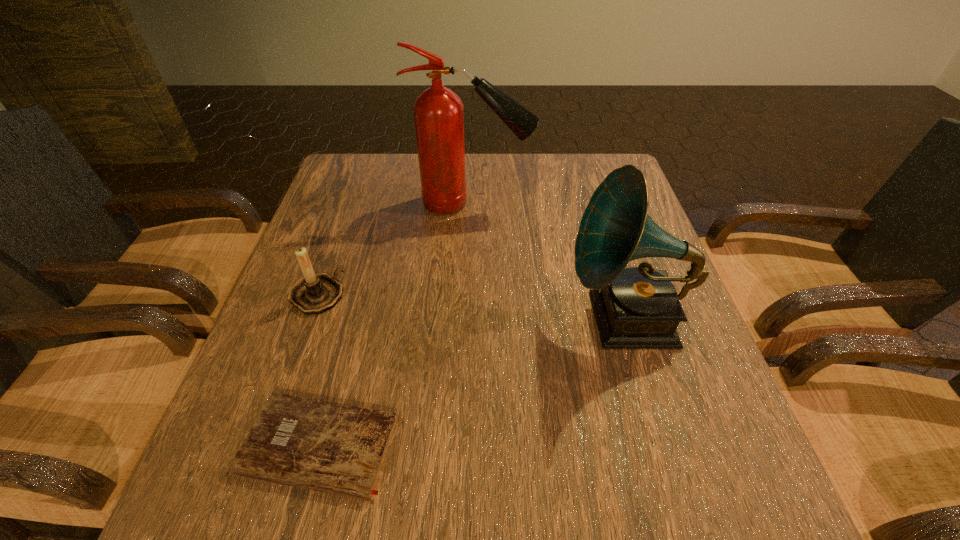
I want to click on the tallest object, so click(x=438, y=112).

You are a GUI agent. You are given a task and a screenshot of the screen. Output one action in this format:
    pyautogui.click(x=<x>, y=<y>)
    Task: Click on the farthest object
    This screenshot has height=540, width=960.
    Given the screenshot: What is the action you would take?
    click(438, 112)

Identify the location of phonograph_record. (638, 307).

Locate an element on the screen. the rightmost object is located at coordinates (638, 307).

The height and width of the screenshot is (540, 960). I want to click on candle holder, so (x=315, y=293).

Find the location of `Bible`. Bible is located at coordinates (339, 449).

What are the coordinates of `the nearest object` in the screenshot? It's located at pyautogui.click(x=339, y=449).

Where is `vacant area located at the nozzle end of the fire extinguisher`? The height and width of the screenshot is (540, 960). vacant area located at the nozzle end of the fire extinguisher is located at coordinates (623, 204).

Where is `vacant space located 0.390m from the horn of the rightmost object`? vacant space located 0.390m from the horn of the rightmost object is located at coordinates (378, 319).

Where is `vacant space located from the horn of the rightmost object`? vacant space located from the horn of the rightmost object is located at coordinates (388, 319).